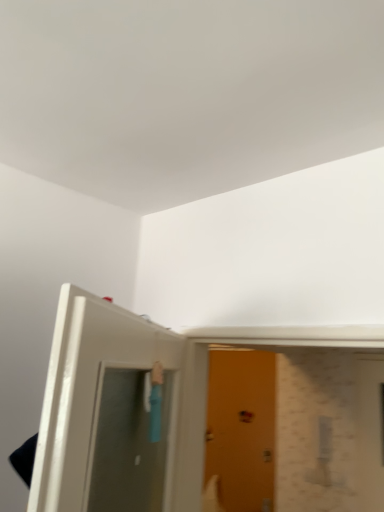
I want to click on wooden door at center, so click(x=242, y=428).

What do you see at coordinates (242, 428) in the screenshot?
I see `wooden door at center` at bounding box center [242, 428].

Locate an element on the screen. This screenshot has height=512, width=384. wooden door at center is located at coordinates (242, 428).